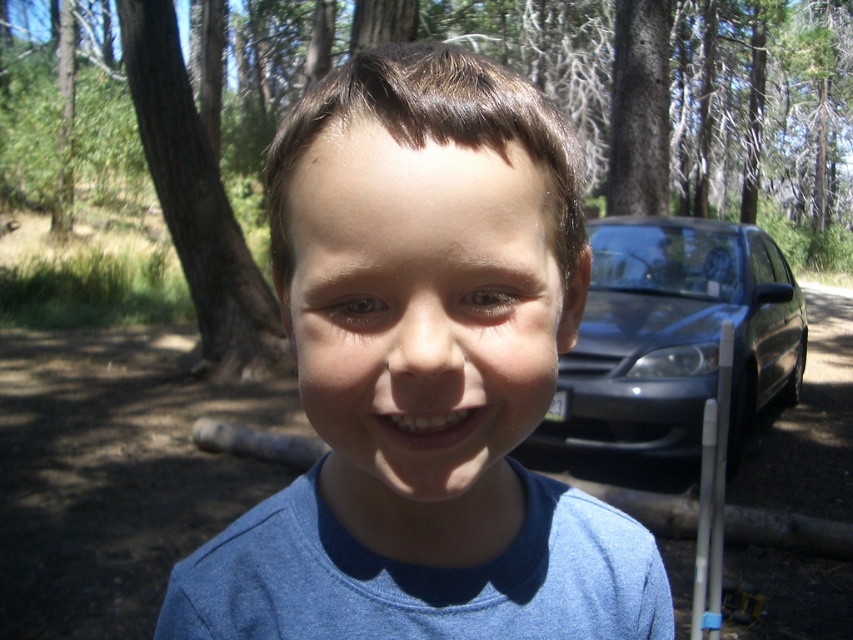
You are a photographer trying to focus on the blue cotton shirt at center. The camera has a focus point at point [424,378]. Will the focus point align with the blue cotton shirt at center?

Yes, the blue cotton shirt at center is located at point [424,378], so the focus point will align with it.

In the scene shown: You are standing in the scene and want to walk from the brown rough tree at left to the satin blue sedan at right. Which direction should you walk to get closer to the sedan?

Since the satin blue sedan at right is closer to the viewer than the brown rough tree at left, you should walk towards the direction of the sedan to get closer to it.